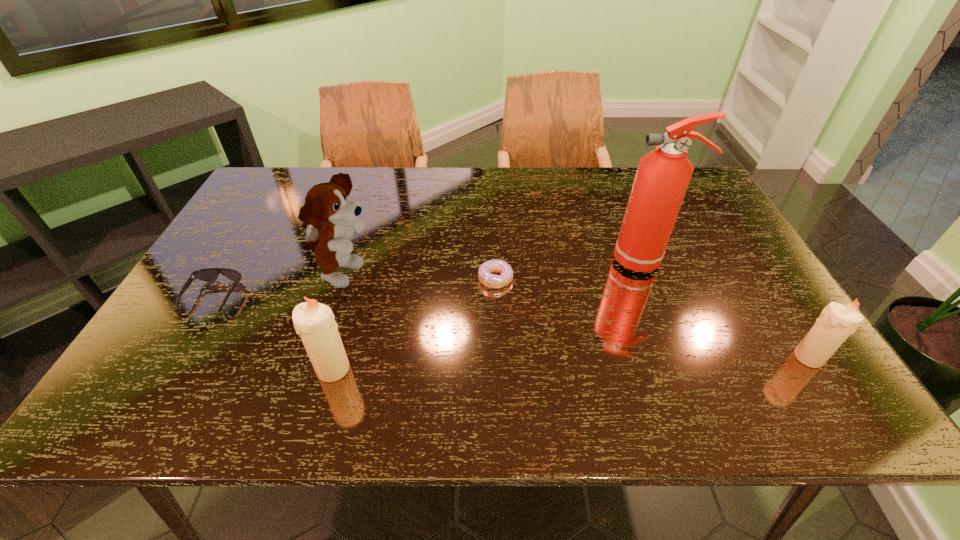
I want to click on free space in the image that satisfies the following two spatial constraints: 1. on the front-facing side of the rightmost object; 2. on the left side of the leftmost object, so click(x=178, y=357).

You are a GUI agent. You are given a task and a screenshot of the screen. Output one action in this format:
    pyautogui.click(x=<x>, y=<y>)
    Task: Click on the vacant point that satisfies the following two spatial constraints: 1. at the nozzle of the fire extinguisher; 2. on the front side of the taller candle
    
    Given the screenshot: What is the action you would take?
    pyautogui.click(x=690, y=369)

Find the location of a particular element. Image resolution: width=960 pixels, height=540 pixels. vacant point that satisfies the following two spatial constraints: 1. on the front-facing side of the shorter candle; 2. on the right side of the leftmost object is located at coordinates (178, 357).

The height and width of the screenshot is (540, 960). I want to click on free space that satisfies the following two spatial constraints: 1. at the nozzle of the fifth object from left to right; 2. on the front-facing side of the sunglasses, so click(x=661, y=298).

Where is `free space that satisfies the following two spatial constraints: 1. at the nozzle of the fire extinguisher; 2. on the front side of the left candle`? Image resolution: width=960 pixels, height=540 pixels. free space that satisfies the following two spatial constraints: 1. at the nozzle of the fire extinguisher; 2. on the front side of the left candle is located at coordinates (690, 369).